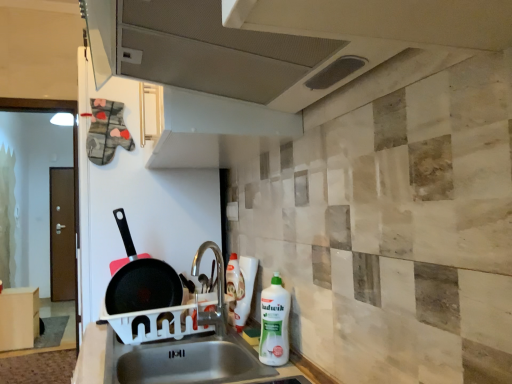
Question: Considering the relative sizes of white plastic sink at lower center and non-stick black frying pan at left in the image provided, is white plastic sink at lower center bigger than non-stick black frying pan at left?

Choices:
 (A) no
 (B) yes

Answer: (B)

Question: From the image's perspective, does white plastic sink at lower center appear higher than non-stick black frying pan at left?

Choices:
 (A) no
 (B) yes

Answer: (A)

Question: Is white plastic sink at lower center thinner than non-stick black frying pan at left?

Choices:
 (A) no
 (B) yes

Answer: (A)

Question: Considering the relative positions of white plastic sink at lower center and non-stick black frying pan at left in the image provided, is white plastic sink at lower center behind non-stick black frying pan at left?

Choices:
 (A) no
 (B) yes

Answer: (A)

Question: Is white plastic sink at lower center to the left of non-stick black frying pan at left from the viewer's perspective?

Choices:
 (A) yes
 (B) no

Answer: (B)

Question: From a real-world perspective, relative to white glossy bottle at center, is white plastic bottle at lower right vertically above or below?

Choices:
 (A) below
 (B) above

Answer: (A)

Question: Considering the relative positions of white plastic bottle at lower right and white glossy bottle at center in the image provided, is white plastic bottle at lower right to the left or to the right of white glossy bottle at center?

Choices:
 (A) left
 (B) right

Answer: (B)

Question: Considering the positions of white plastic bottle at lower right and white glossy bottle at center in the image, is white plastic bottle at lower right taller or shorter than white glossy bottle at center?

Choices:
 (A) tall
 (B) short

Answer: (B)

Question: Considering the positions of white plastic bottle at lower right and white glossy bottle at center in the image, is white plastic bottle at lower right bigger or smaller than white glossy bottle at center?

Choices:
 (A) big
 (B) small

Answer: (A)

Question: From their relative heights in the image, would you say white plastic sink at lower center is taller or shorter than white glossy bottle at center?

Choices:
 (A) short
 (B) tall

Answer: (A)

Question: Relative to white glossy bottle at center, is white plastic sink at lower center in front or behind?

Choices:
 (A) behind
 (B) front

Answer: (B)

Question: From a real-world perspective, relative to white glossy bottle at center, is white plastic sink at lower center vertically above or below?

Choices:
 (A) above
 (B) below

Answer: (B)

Question: Would you say white plastic sink at lower center is inside or outside white glossy bottle at center?

Choices:
 (A) inside
 (B) outside

Answer: (B)

Question: Considering the positions of point (282, 331) and point (264, 31), is point (282, 331) closer or farther from the camera than point (264, 31)?

Choices:
 (A) farther
 (B) closer

Answer: (A)

Question: From a real-world perspective, is white plastic bottle at lower right above or below metallic gray exhaust hood at upper center?

Choices:
 (A) below
 (B) above

Answer: (A)